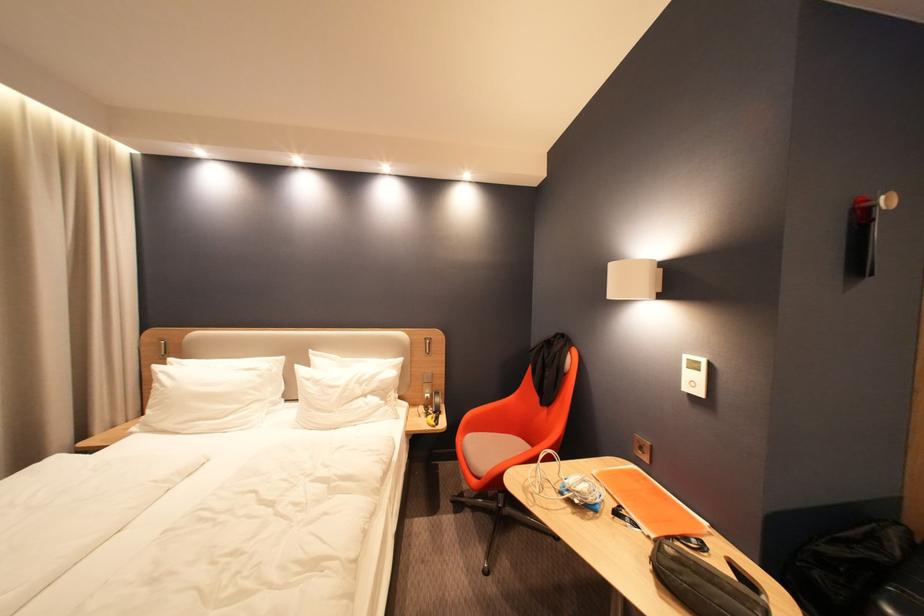
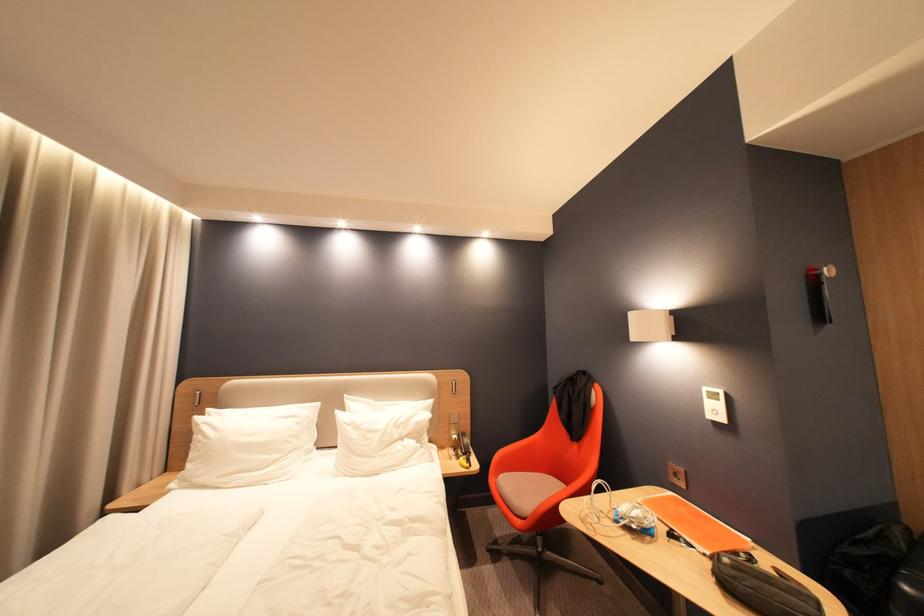
Find the pixel in the second image that matches point 888,200 in the first image.

(830, 270)